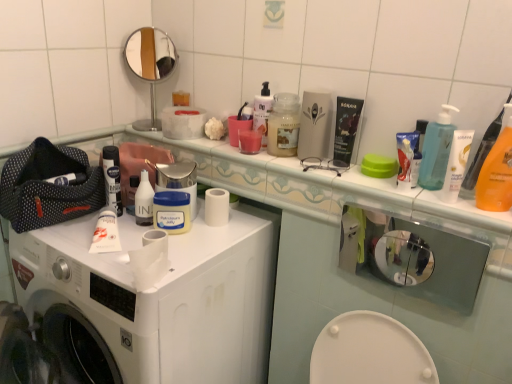
This screenshot has width=512, height=384. I want to click on free space in front of white plastic bottle at center, the 1th toiletry when ordered from left to right, so click(x=106, y=251).